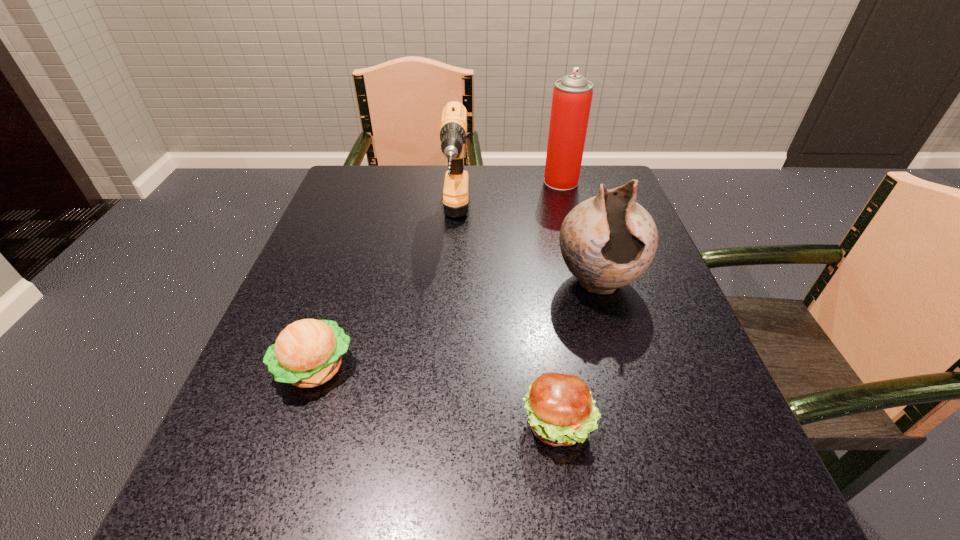
In the image, there is a desktop. At what (x,y) coordinates should I click in order to perform the action: click on blank space at the near left corner. Please return your answer as a coordinate pair (x, y). This screenshot has width=960, height=540. Looking at the image, I should click on (223, 538).

Image resolution: width=960 pixels, height=540 pixels. I want to click on free location at the near right corner of the desktop, so click(646, 477).

The image size is (960, 540). Identify the location of vacant region between the right hamburger and the pottery. (578, 353).

Find the location of a particular element. empty space between the drill and the pottery is located at coordinates (527, 251).

You are a GUI agent. You are given a task and a screenshot of the screen. Output one action in this format:
    pyautogui.click(x=<x>, y=<y>)
    Task: Click on the free area in between the left hamburger and the aerosol can
    This screenshot has height=540, width=960.
    Given the screenshot: What is the action you would take?
    pyautogui.click(x=438, y=275)

Where is `free space between the leftmost object and the pottery`? free space between the leftmost object and the pottery is located at coordinates (456, 325).

Where is `free space between the drill and the right hamburger`? free space between the drill and the right hamburger is located at coordinates (507, 322).

Image resolution: width=960 pixels, height=540 pixels. Find the location of `free space between the fourth object from right to left and the aerosol can`. free space between the fourth object from right to left and the aerosol can is located at coordinates (509, 201).

You are a GUI agent. You are given a task and a screenshot of the screen. Output one action in this format:
    pyautogui.click(x=<x>, y=<y>)
    Task: Click on the vacant region between the leftmost object and the right hamburger
    The width and height of the screenshot is (960, 540).
    Given the screenshot: What is the action you would take?
    pyautogui.click(x=437, y=396)

Find the location of `vacant space in between the fourth object from right to left and the right hamburger`. vacant space in between the fourth object from right to left and the right hamburger is located at coordinates (507, 322).